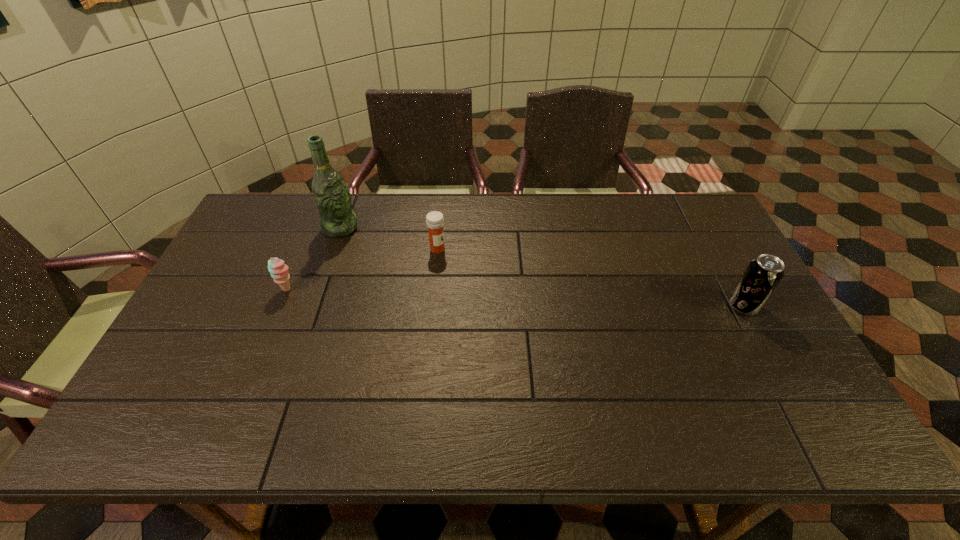
The height and width of the screenshot is (540, 960). In the image, there is a desktop. Identify the location of free space at the right edge. point(755,317).

The width and height of the screenshot is (960, 540). Find the location of `free space at the far left corner of the desktop`. free space at the far left corner of the desktop is located at coordinates (252, 217).

Image resolution: width=960 pixels, height=540 pixels. In the image, there is a desktop. Identify the location of vacant space at the near left corner. (203, 376).

Image resolution: width=960 pixels, height=540 pixels. In the image, there is a desktop. In order to click on blank space at the near right corner in this screenshot , I will do `click(762, 375)`.

The height and width of the screenshot is (540, 960). I want to click on free space that is in between the third nearest object and the leftmost object, so click(363, 269).

Locate an element on the screen. The height and width of the screenshot is (540, 960). vacant space in between the second object from left to right and the third nearest object is located at coordinates (389, 239).

Where is `vacant space in between the farthest object and the third object from left to right`? vacant space in between the farthest object and the third object from left to right is located at coordinates (389, 239).

Where is `free spot between the farthest object and the second object from right to left`? free spot between the farthest object and the second object from right to left is located at coordinates (389, 239).

I want to click on unoccupied position between the third object from left to right and the leftmost object, so click(363, 269).

You are a GUI agent. You are given a task and a screenshot of the screen. Output one action in this format:
    pyautogui.click(x=<x>, y=<y>)
    Task: Click on the free space between the medicine and the sherbert
    
    Given the screenshot: What is the action you would take?
    pyautogui.click(x=363, y=269)